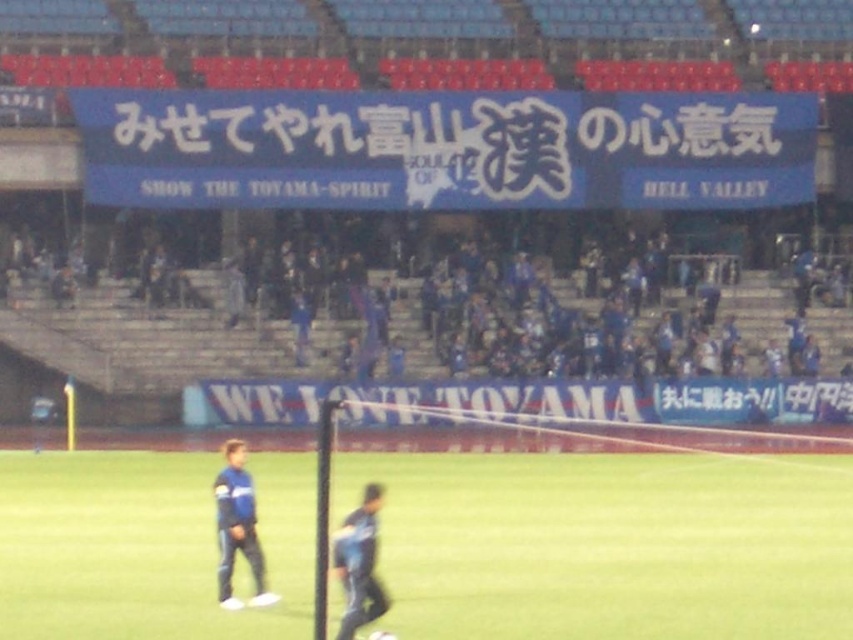
You are a photographer trying to capture a wide shot of the soccer field. You need to ensure both the green grass field at center and the blue fabric pants at lower center are visible. Given their sizes, which object will occupy more of the frame?

The green grass field at center is bigger than the blue fabric pants at lower center, so it will occupy more of the frame.

You are a photographer positioned at the camera. You need to capture a closeup shot of the blue fabric shirt at lower left. Given that your camera can focus on objects within 50 feet, will you be able to take the closeup shot without moving closer?

The blue fabric shirt at lower left is 66.70 feet away from the camera. Since the camera can only focus on objects within 50 feet, you will not be able to take a closeup shot without moving closer.